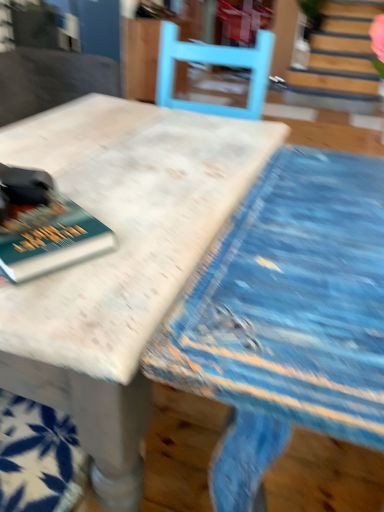
I want to click on unoccupied area behind hardcover book at left, so click(x=101, y=186).